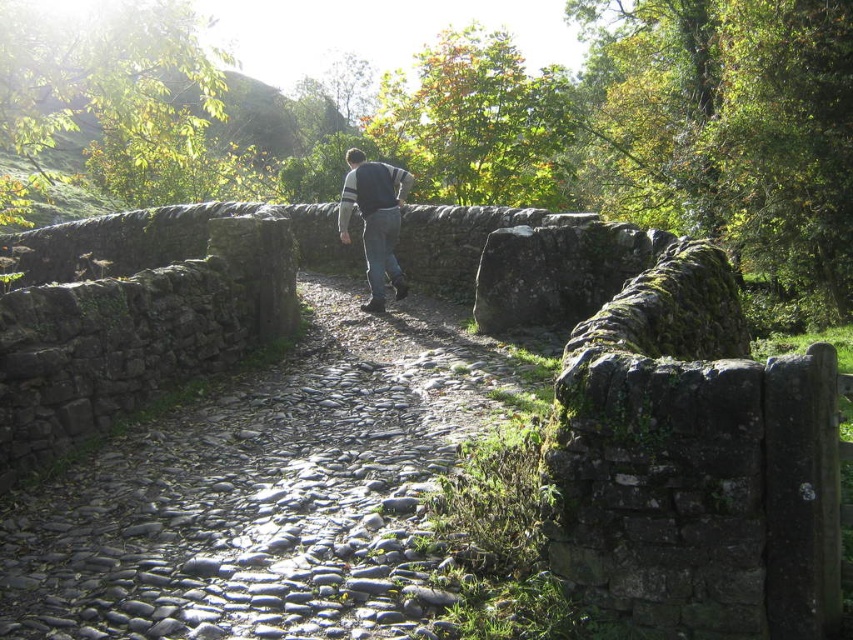
You are standing on the rustic stone bridge and see the gray cobblestone trail at center and the dark gray sweater at center. Which object is positioned to the right of the other?

The gray cobblestone trail at center is to the right of the dark gray sweater at center.

You are standing on the gray cobblestone trail at center and looking towards the dark gray sweater at center. Which object is closer to you?

The gray cobblestone trail at center is closer to you because it has a smaller size compared to the dark gray sweater at center, indicating it is nearer.

You are standing on the rustic stone bridge and notice the gray cobblestone trail at center and the dark gray sweater at center. Which object is closer to the ground?

The gray cobblestone trail at center is below dark gray sweater at center, so it is closer to the ground.